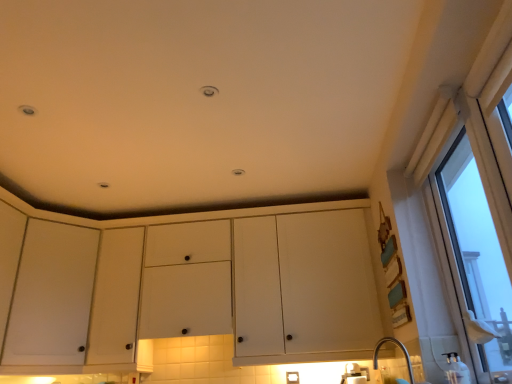
Question: From a real-world perspective, is clear glass window at right physically above white matte cabinet at center?

Choices:
 (A) no
 (B) yes

Answer: (A)

Question: Can white matte cabinet at center be found inside clear glass window at right?

Choices:
 (A) no
 (B) yes

Answer: (A)

Question: Can you confirm if clear glass window at right is thinner than white matte cabinet at center?

Choices:
 (A) no
 (B) yes

Answer: (B)

Question: Is clear glass window at right facing towards white matte cabinet at center?

Choices:
 (A) yes
 (B) no

Answer: (B)

Question: Does clear glass window at right appear on the right side of white matte cabinet at center?

Choices:
 (A) no
 (B) yes

Answer: (B)

Question: From their relative heights in the image, would you say white matte cabinet at left is taller or shorter than white matte cabinet at center?

Choices:
 (A) short
 (B) tall

Answer: (B)

Question: Is white matte cabinet at left wider or thinner than white matte cabinet at center?

Choices:
 (A) wide
 (B) thin

Answer: (A)

Question: Is point (41, 331) positioned closer to the camera than point (312, 332)?

Choices:
 (A) farther
 (B) closer

Answer: (B)

Question: Considering the relative positions of white matte cabinet at left and white matte cabinet at center in the image provided, is white matte cabinet at left to the left or to the right of white matte cabinet at center?

Choices:
 (A) right
 (B) left

Answer: (B)

Question: Relative to clear glass window at right, is white matte cabinet at center in front or behind?

Choices:
 (A) behind
 (B) front

Answer: (A)

Question: From a real-world perspective, relative to clear glass window at right, is white matte cabinet at center vertically above or below?

Choices:
 (A) below
 (B) above

Answer: (B)

Question: Considering the positions of white matte cabinet at center and clear glass window at right in the image, is white matte cabinet at center bigger or smaller than clear glass window at right?

Choices:
 (A) small
 (B) big

Answer: (B)

Question: From the image's perspective, is white matte cabinet at center positioned above or below clear glass window at right?

Choices:
 (A) below
 (B) above

Answer: (A)

Question: From the image's perspective, is clear glass window at right above or below white matte cabinet at left?

Choices:
 (A) below
 (B) above

Answer: (B)

Question: Is clear glass window at right inside or outside of white matte cabinet at left?

Choices:
 (A) outside
 (B) inside

Answer: (A)